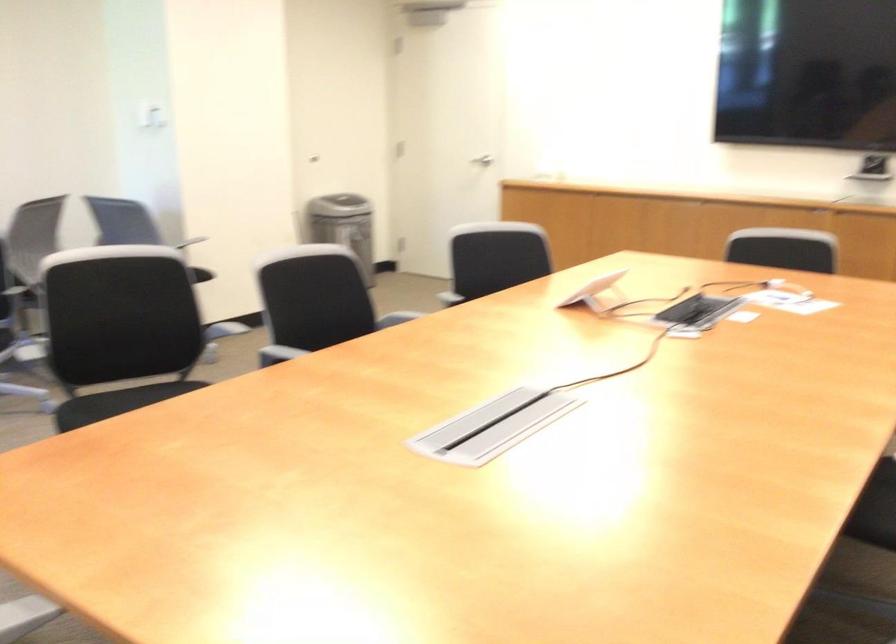
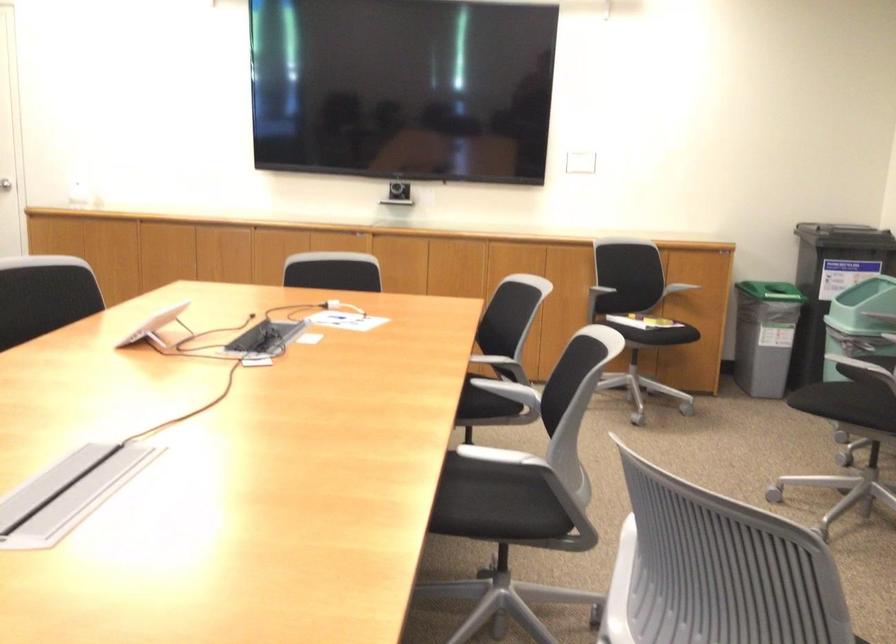
In the second image, find the point that corresponds to point 587,290 in the first image.

(156, 327)